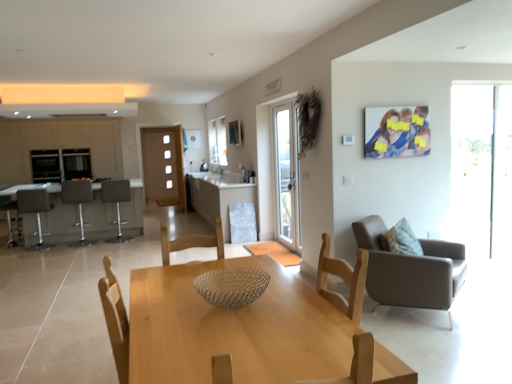
Question: Is matte white cabinetry at left completely or partially outside of white marble table at center, which is the first table in right-to-left order?

Choices:
 (A) no
 (B) yes

Answer: (B)

Question: Does matte white cabinetry at left have a larger size compared to white marble table at center, which is the first table in right-to-left order?

Choices:
 (A) yes
 (B) no

Answer: (A)

Question: From the image's perspective, is matte white cabinetry at left above white marble table at center, which ranks as the 2th table in left-to-right order?

Choices:
 (A) no
 (B) yes

Answer: (B)

Question: Is the position of matte white cabinetry at left less distant than that of white marble table at center, which is the first table in right-to-left order?

Choices:
 (A) yes
 (B) no

Answer: (B)

Question: Considering the relative positions of matte white cabinetry at left and white marble table at center, which is the first table in right-to-left order, in the image provided, is matte white cabinetry at left to the left of white marble table at center, which is the first table in right-to-left order, from the viewer's perspective?

Choices:
 (A) yes
 (B) no

Answer: (A)

Question: Visually, is white marble table at center, which is the first table in right-to-left order, positioned to the left or to the right of textured beige pillow at right?

Choices:
 (A) left
 (B) right

Answer: (A)

Question: In the image, is white marble table at center, which ranks as the 2th table in left-to-right order, positioned in front of or behind textured beige pillow at right?

Choices:
 (A) front
 (B) behind

Answer: (B)

Question: Is white marble table at center, which is the first table in right-to-left order, situated inside textured beige pillow at right or outside?

Choices:
 (A) inside
 (B) outside

Answer: (B)

Question: From a real-world perspective, is white marble table at center, which ranks as the 2th table in left-to-right order, positioned above or below textured beige pillow at right?

Choices:
 (A) above
 (B) below

Answer: (B)

Question: From a real-world perspective, is matte gray armchair at right, acting as the 4th chair starting from the back, positioned above or below matte plastic photo frame at upper right?

Choices:
 (A) below
 (B) above

Answer: (A)

Question: In the image, is matte gray armchair at right, which is the fourth chair from left to right, positioned in front of or behind matte plastic photo frame at upper right?

Choices:
 (A) behind
 (B) front

Answer: (B)

Question: Is matte gray armchair at right, positioned as the 1th chair in front-to-back order, inside or outside of matte plastic photo frame at upper right?

Choices:
 (A) inside
 (B) outside

Answer: (B)

Question: Would you say matte gray armchair at right, acting as the 4th chair starting from the back, is to the left or to the right of matte plastic photo frame at upper right in the picture?

Choices:
 (A) left
 (B) right

Answer: (A)

Question: In the image, is light wood table at center positioned in front of or behind white marble table at center, which ranks as the 2th table in left-to-right order?

Choices:
 (A) front
 (B) behind

Answer: (A)

Question: Is light wood table at center inside the boundaries of white marble table at center, which ranks as the 2th table in left-to-right order, or outside?

Choices:
 (A) outside
 (B) inside

Answer: (A)